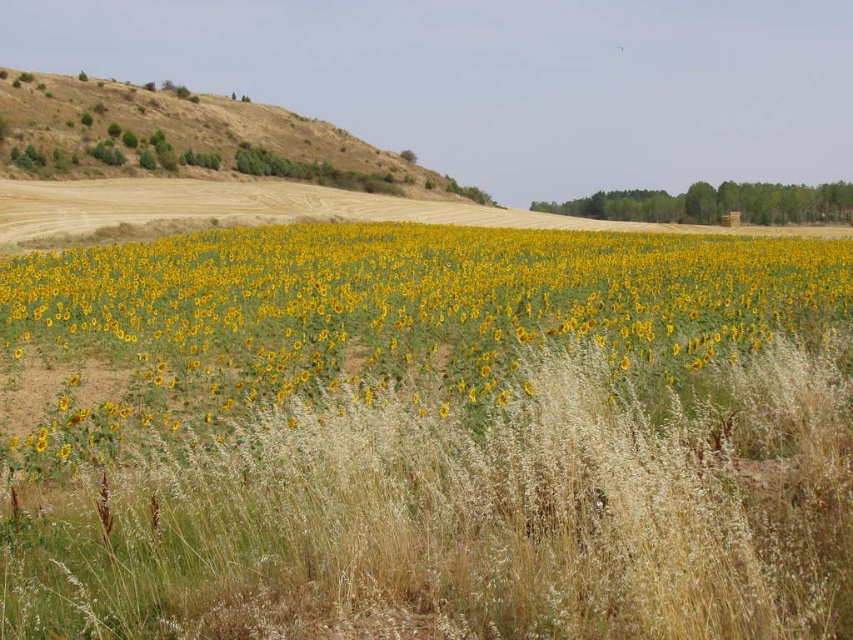
Can you confirm if yellow matte sunflower at center is positioned to the right of brown/dry grass at upper left?

Indeed, yellow matte sunflower at center is positioned on the right side of brown/dry grass at upper left.

Which of these two, yellow matte sunflower at center or brown/dry grass at upper left, stands shorter?

yellow matte sunflower at center

Which is behind, point (701, 280) or point (50, 122)?

The point (50, 122) is more distant.

What are the coordinates of `yellow matte sunflower at center` in the screenshot? It's located at (373, 316).